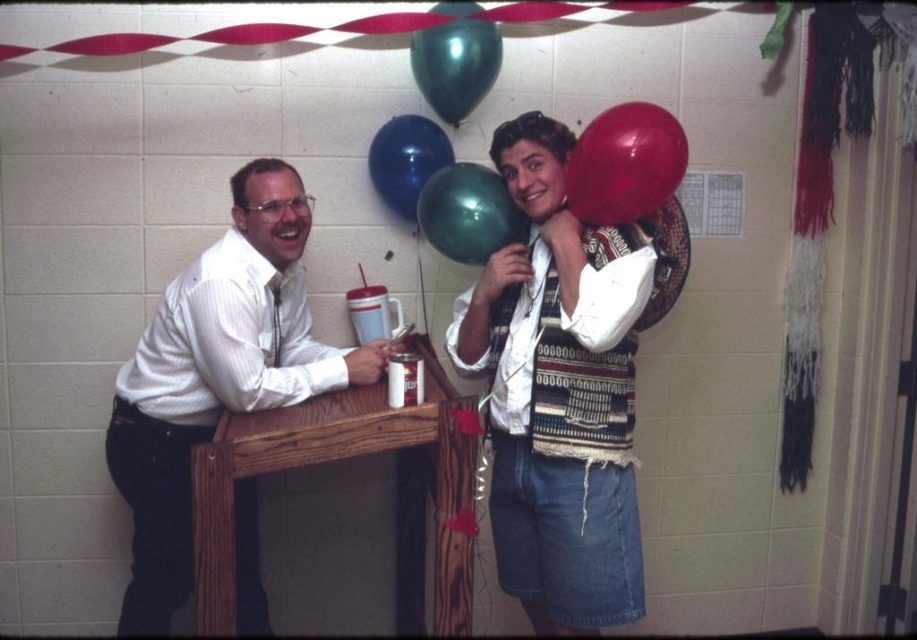
You are organizing a party and need to decide whether to place a large centerpiece on the table between the white shirt at left and the green matte balloon at upper center. Based on their sizes, which object should you consider for placement to ensure the centerpiece doesn t overwhelm either?

The white shirt at left is larger in size than the green matte balloon at upper center. Therefore, the centerpiece should be placed closer to the green matte balloon at upper center to avoid overwhelming the larger white shirt at left.

You are standing in the room and want to locate the white shirt at left. According to the coordinates provided, where should you look?

You should look at point (216, 376) to find the white shirt at left.

You are planning to hang a small picture frame between the green matte balloon at upper center and the green metallic balloon at upper center. Which balloon should the frame be placed closer to if you want it to be closer to the taller one?

The green metallic balloon at upper center is taller than the green matte balloon at upper center. Therefore, to place the picture frame closer to the taller one, it should be positioned nearer to the green metallic balloon at upper center.